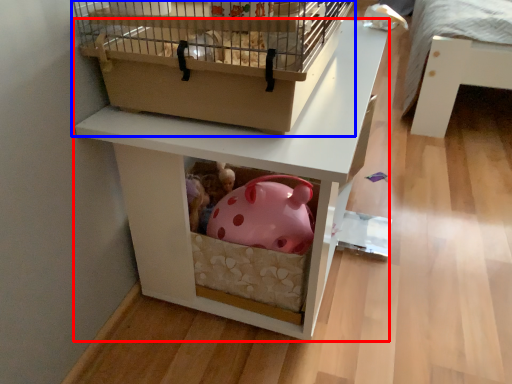
Question: Among these objects, which one is farthest to the camera, furniture (highlighted by a red box) or bird cage (highlighted by a blue box)?

Choices:
 (A) furniture
 (B) bird cage

Answer: (A)